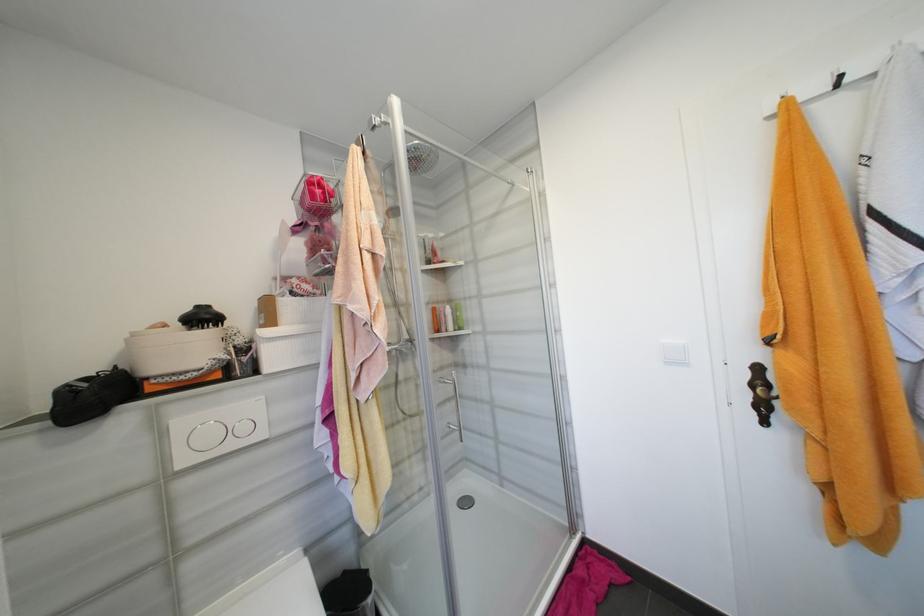
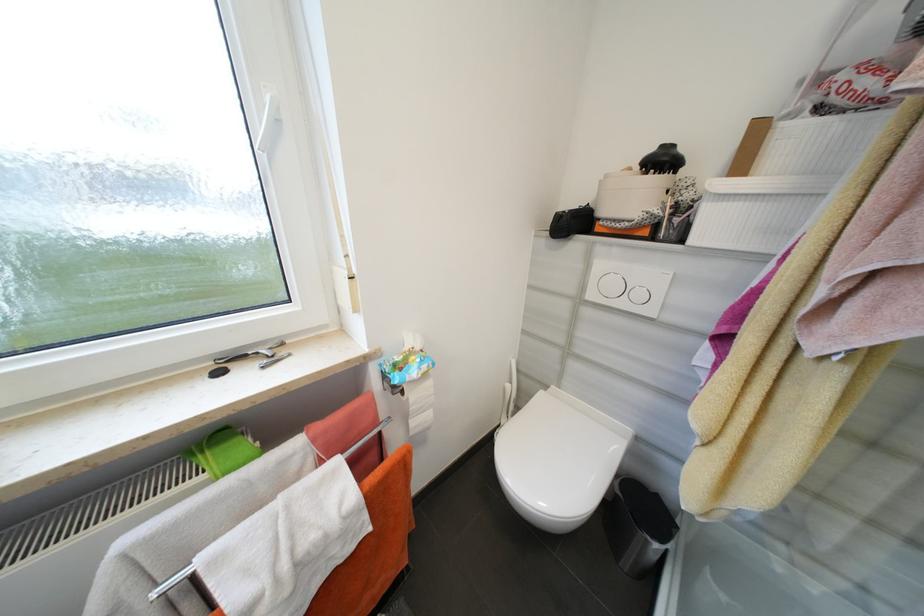
Locate, in the second image, the point that corresponds to pixel 262 373 in the first image.

(687, 241)